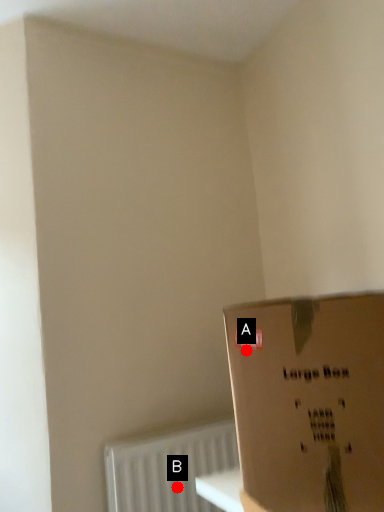
Question: Two points are circled on the image, labeled by A and B beside each circle. Among these points, which one is nearest to the camera?

Choices:
 (A) A is closer
 (B) B is closer

Answer: (A)